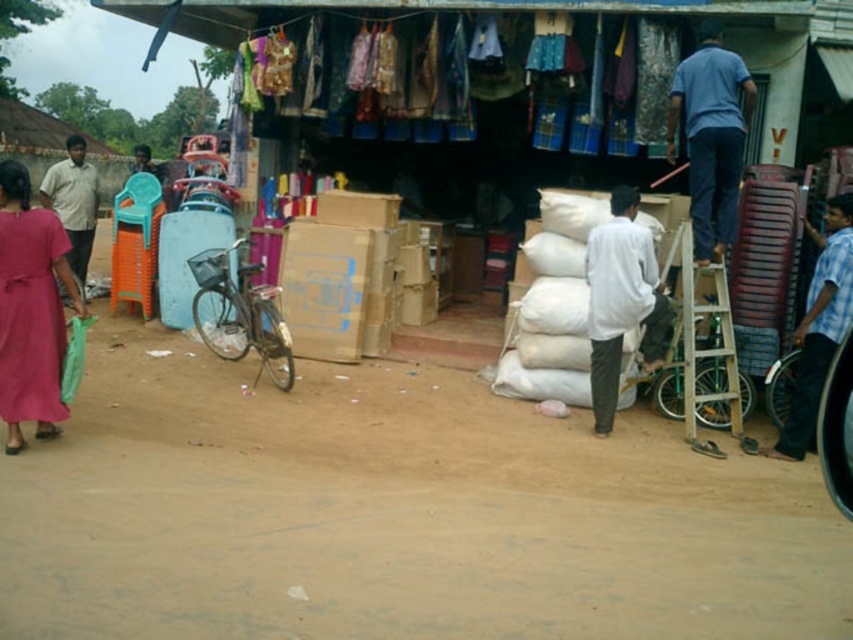
Question: Considering the relative positions of blue cotton shirt at upper center and light brown shirt at left in the image provided, where is blue cotton shirt at upper center located with respect to light brown shirt at left?

Choices:
 (A) below
 (B) above

Answer: (A)

Question: Which object is closer to the camera taking this photo?

Choices:
 (A) blue cotton shirt at upper center
 (B) white matte shirt at center

Answer: (B)

Question: Which of the following is the farthest from the observer?

Choices:
 (A) (840, 321)
 (B) (624, 193)
 (C) (688, 99)
 (D) (47, 257)

Answer: (C)

Question: Is matte pink dress at lower left above blue cotton shirt at upper center?

Choices:
 (A) yes
 (B) no

Answer: (B)

Question: Is the position of blue cotton shirt at upper center more distant than that of white matte shirt at center?

Choices:
 (A) no
 (B) yes

Answer: (B)

Question: Which point is farther to the camera?

Choices:
 (A) blue checkered shirt at right
 (B) light brown shirt at left

Answer: (B)